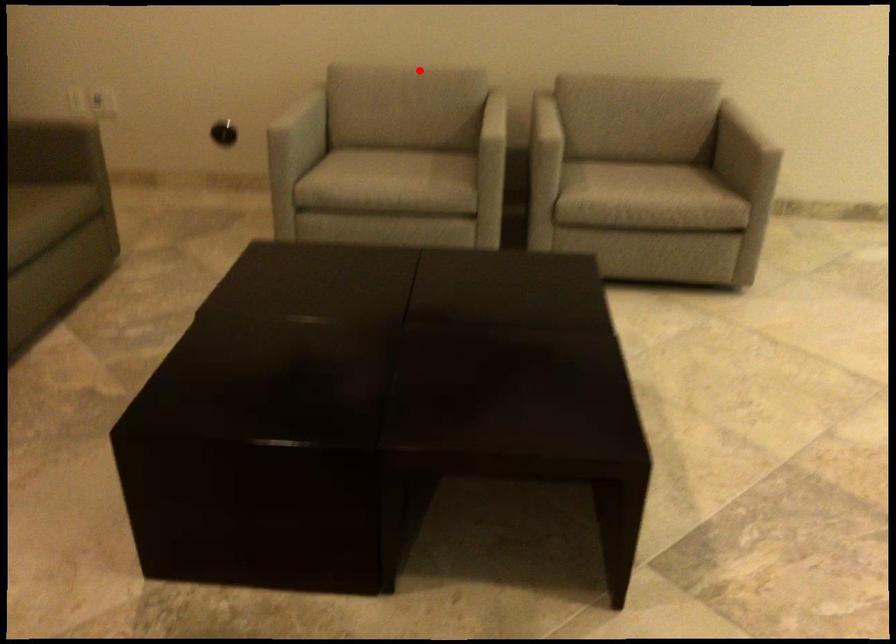
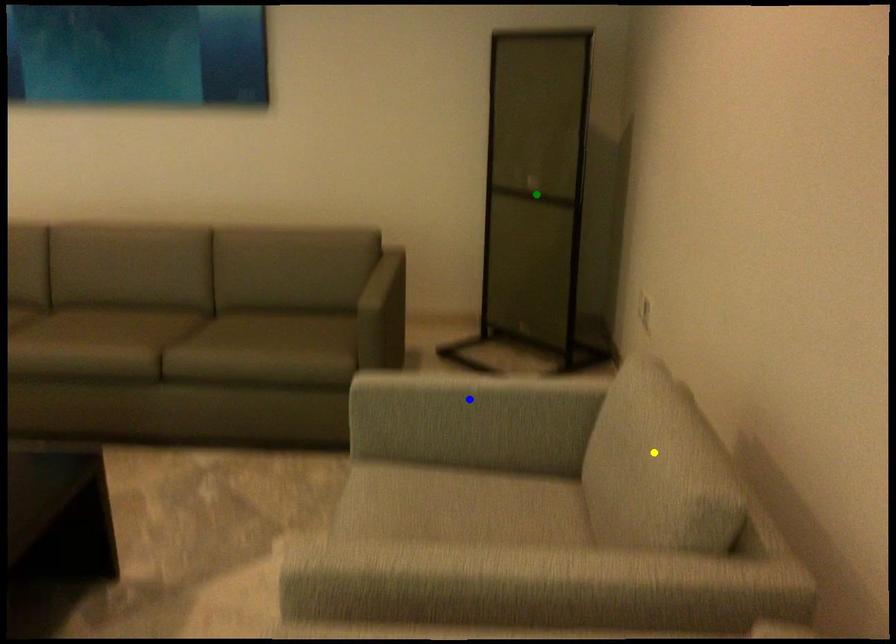
Question: I am providing you with two images of the same scene from different viewpoints. A red point is marked on the first image. You are given multiple points on the second image. Which point in image 2 represents the same 3d spot as the red point in image 1?

Choices:
 (A) yellow point
 (B) green point
 (C) blue point

Answer: (A)